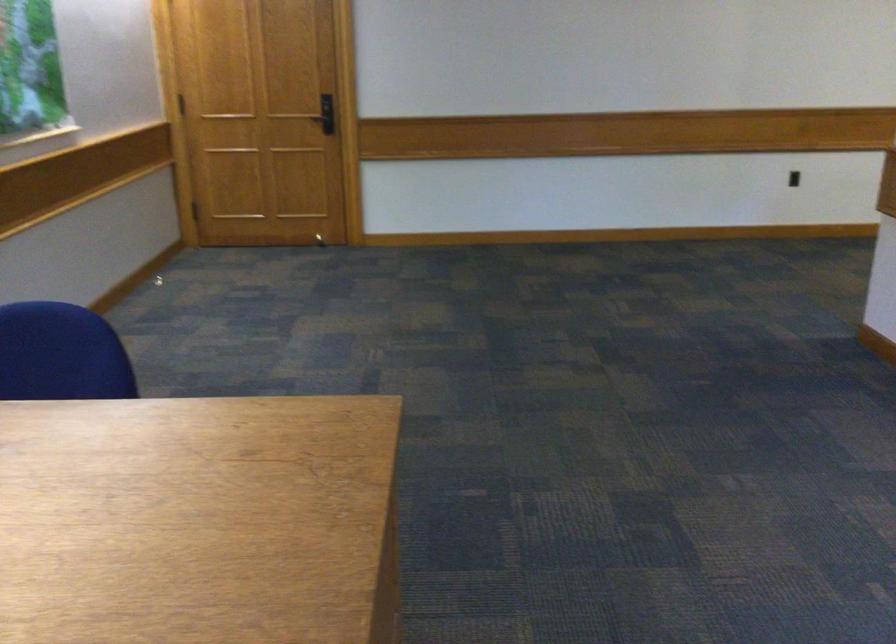
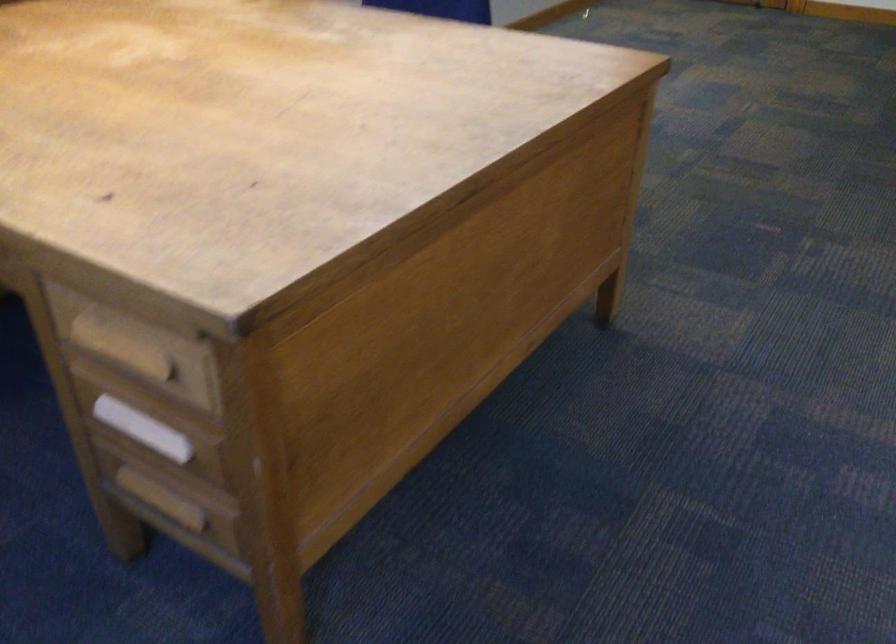
Looking at this image, the first image is from the beginning of the video and the second image is from the end. How did the camera likely rotate when shooting the video?

The camera's rotation is toward left-down.